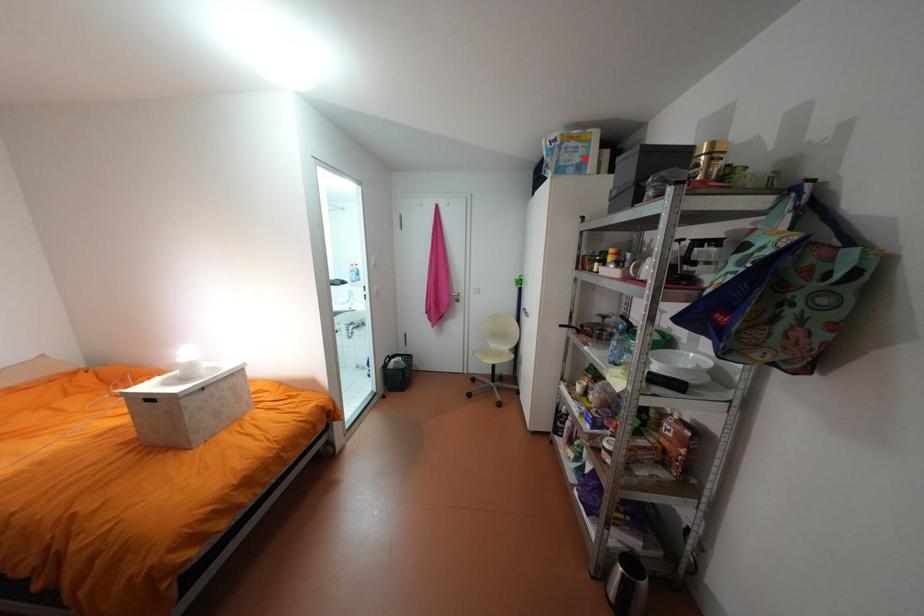
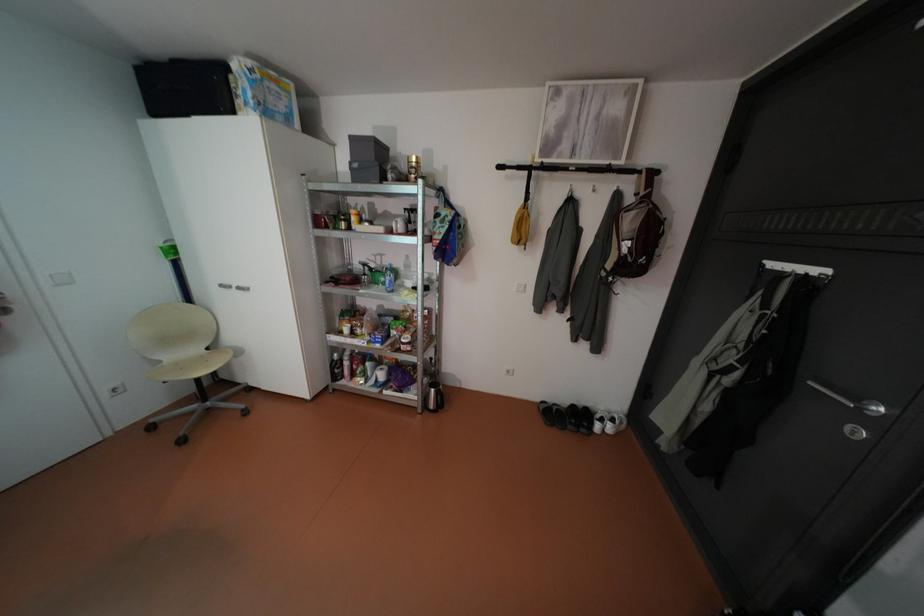
Find the pixel in the second image that matches the highlighted location in the first image.

(290, 107)